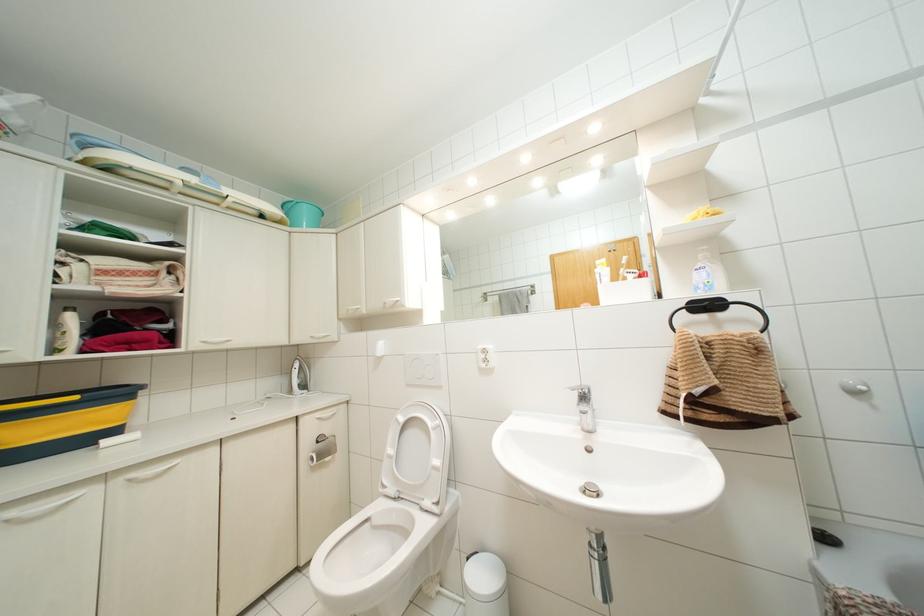
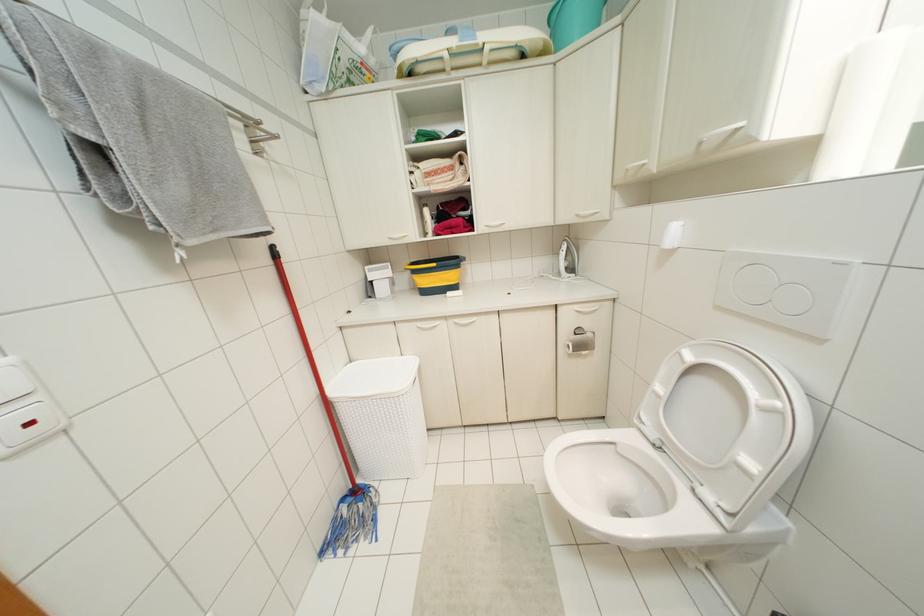
Locate, in the second image, the point that corresponds to the point at 75,397 in the first image.

(433, 264)